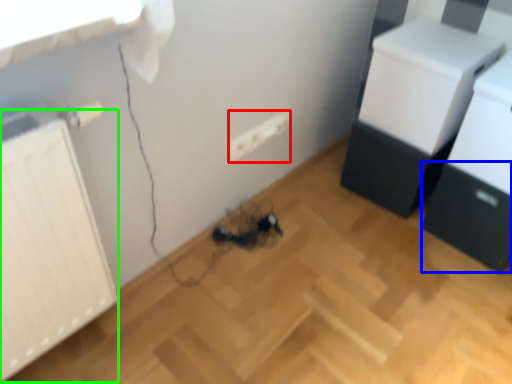
Question: Estimate the real-world distances between objects in this image. Which object is closer to electric outlet (highlighted by a red box), drawer (highlighted by a blue box) or radiator (highlighted by a green box)?

Choices:
 (A) drawer
 (B) radiator

Answer: (B)